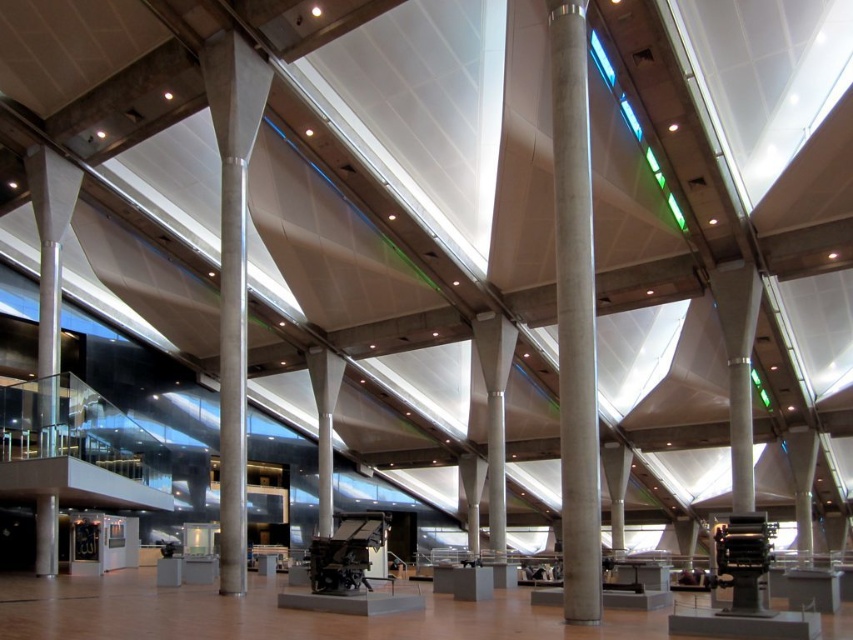
Does concrete column at center have a greater width compared to concrete at center?

No.

Between concrete column at center and concrete at center, which one appears on the right side from the viewer's perspective?

concrete column at center is more to the right.

Is point (573, 451) more distant than point (231, 244)?

No, it is not.

Find the location of a particular element. The width and height of the screenshot is (853, 640). concrete column at center is located at coordinates (575, 312).